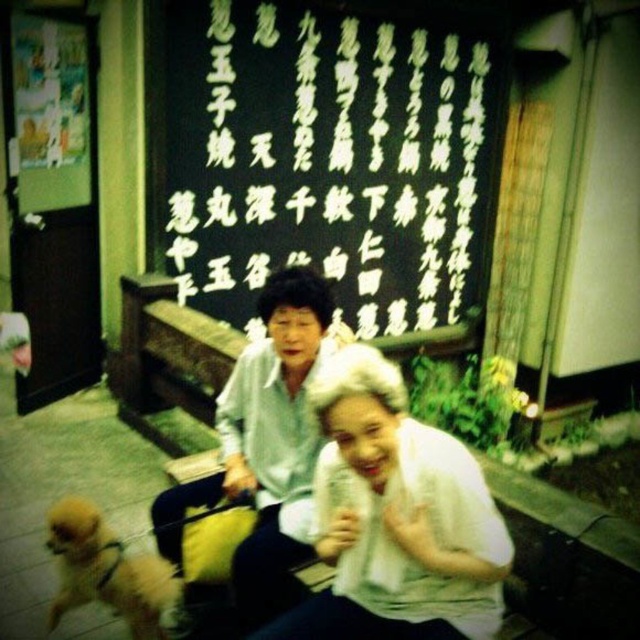
You are a photographer trying to capture both the white sheer fabric at center and the white matte shirt at center in a single shot. Given their sizes, which object might appear smaller in the photo?

The white sheer fabric at center appears smaller in the photo because it has a smaller size compared to the white matte shirt at center.

You are a fashion designer observing the two white items at the scene. Which one is shorter in length between the white sheer fabric at center and the white matte shirt at center?

The white sheer fabric at center is shorter than the white matte shirt at center.

You are a photographer taking a picture of the white sheer fabric at center and the golden fur dog at lower left. Which object should you focus on first if you want to capture both in sharp focus?

The white sheer fabric at center is above the golden fur dog at lower left, so you should focus on the golden fur dog at lower left first to ensure both are in focus since it is closer to the camera.